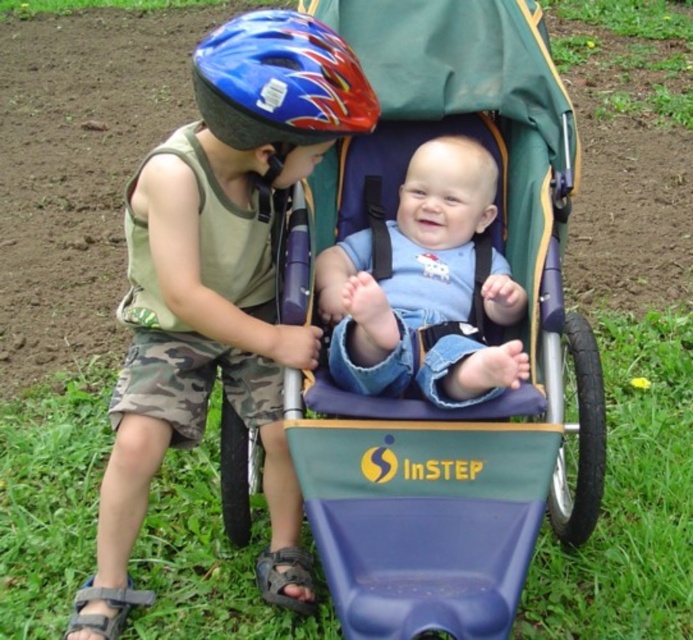
Question: Which object is the farthest from the shiny blue helmet at upper left?

Choices:
 (A) matte blue helmet at center
 (B) blue plastic stroller at center
 (C) blue denim shirt at center

Answer: (B)

Question: Is blue plastic stroller at center bigger than shiny blue helmet at upper left?

Choices:
 (A) no
 (B) yes

Answer: (B)

Question: Does blue plastic stroller at center appear over blue denim shirt at center?

Choices:
 (A) no
 (B) yes

Answer: (A)

Question: Observing the image, what is the correct spatial positioning of blue plastic stroller at center in reference to matte blue helmet at center?

Choices:
 (A) above
 (B) below

Answer: (A)

Question: Which point is farther to the camera?

Choices:
 (A) [313, 529]
 (B) [261, 33]

Answer: (A)

Question: Which point is closer to the camera taking this photo?

Choices:
 (A) tap(426, 154)
 (B) tap(173, 172)
 (C) tap(498, 417)
 (D) tap(256, 115)

Answer: (D)